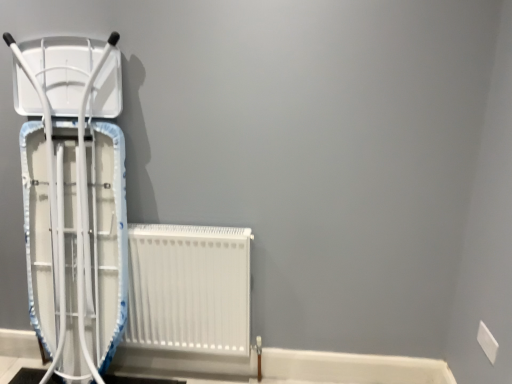
What do you see at coordinates (189, 288) in the screenshot? I see `white matte radiator at lower left` at bounding box center [189, 288].

At what (x,y) coordinates should I click in order to perform the action: click on white matte radiator at lower left. Please return your answer as a coordinate pair (x, y). Image resolution: width=512 pixels, height=384 pixels. Looking at the image, I should click on (189, 288).

The image size is (512, 384). Find the location of `white matte radiator at lower left`. white matte radiator at lower left is located at coordinates (189, 288).